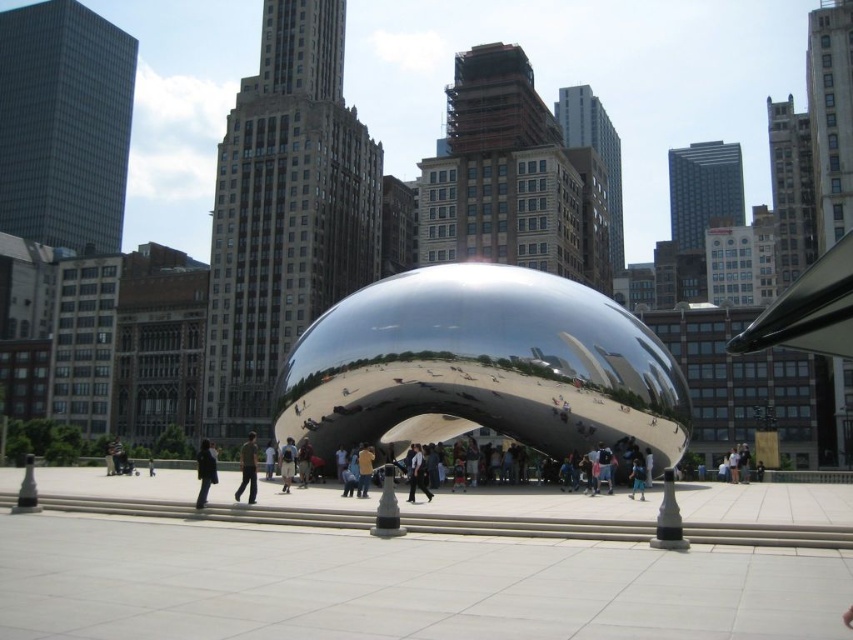
Question: Observing the image, what is the correct spatial positioning of light blue shirt at center in reference to brown leather jacket at center?

Choices:
 (A) right
 (B) left

Answer: (A)

Question: Which point is closer to the camera?

Choices:
 (A) (207, 445)
 (B) (242, 465)

Answer: (A)

Question: Which point is closer to the camera?

Choices:
 (A) (366, 464)
 (B) (251, 433)

Answer: (A)

Question: Which point is farther to the camera?

Choices:
 (A) (282, 456)
 (B) (412, 445)
 (C) (363, 493)

Answer: (A)

Question: Can you confirm if green fabric shirt at center is positioned below light blue shirt at center?

Choices:
 (A) no
 (B) yes

Answer: (B)

Question: Can you confirm if light blue shirt at center is positioned below light brown fabric pants at center?

Choices:
 (A) yes
 (B) no

Answer: (A)